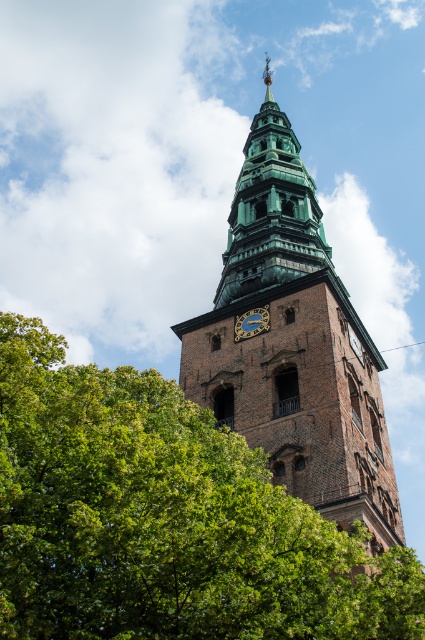
Is green leafy tree at lower left positioned before brown brick church tower at center?

That is True.

At what (x,y) coordinates should I click in order to perform the action: click on green leafy tree at lower left. Please return your answer as a coordinate pair (x, y). Image resolution: width=425 pixels, height=640 pixels. Looking at the image, I should click on (164, 518).

Between green patina bell tower at upper center and green metallic clock at center, which one has more height?

Standing taller between the two is green patina bell tower at upper center.

Locate an element on the screen. green patina bell tower at upper center is located at coordinates (271, 211).

Which of these two, green leafy tree at lower left or green metallic clock at center, stands shorter?

With less height is green metallic clock at center.

Is green leafy tree at lower left to the left of green metallic clock at center from the viewer's perspective?

Indeed, green leafy tree at lower left is positioned on the left side of green metallic clock at center.

Locate an element on the screen. The width and height of the screenshot is (425, 640). green leafy tree at lower left is located at coordinates (164, 518).